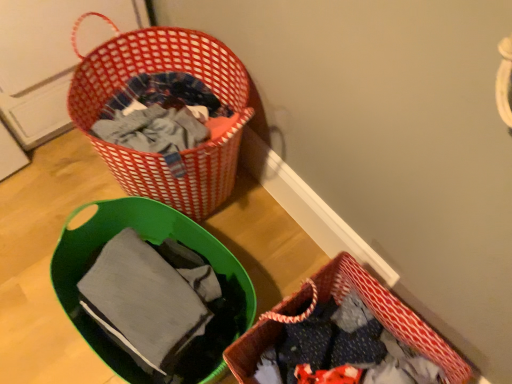
What is the approximate width of red woven basket at upper left, placed as the first picnic basket when sorted from left to right?

red woven basket at upper left, placed as the first picnic basket when sorted from left to right, is 15.67 inches wide.

Describe the element at coordinates (164, 71) in the screenshot. I see `red woven basket at upper left, the first picnic basket when ordered from top to bottom` at that location.

In order to face red woven picnic basket at lower right, arranged as the 2th picnic basket when viewed from the left, should I rotate leftwards or rightwards?

Rotate right and turn 11.274 degrees.

Where is `red woven picnic basket at lower right, arranged as the 2th picnic basket when viewed from the left`? Image resolution: width=512 pixels, height=384 pixels. red woven picnic basket at lower right, arranged as the 2th picnic basket when viewed from the left is located at coordinates (339, 298).

The width and height of the screenshot is (512, 384). Identify the location of red woven basket at upper left, the 2th picnic basket ordered from the bottom. (164, 71).

Considering the sizes of objects red woven picnic basket at lower right, which ranks as the 2th picnic basket in top-to-bottom order, and matte gray fabric at lower left in the image provided, who is thinner, red woven picnic basket at lower right, which ranks as the 2th picnic basket in top-to-bottom order, or matte gray fabric at lower left?

Thinner between the two is matte gray fabric at lower left.

Which object is further away from the camera taking this photo, red woven picnic basket at lower right, arranged as the first picnic basket when viewed from the right, or matte gray fabric at lower left?

matte gray fabric at lower left is more distant.

At what (x,y) coordinates should I click in order to perform the action: click on baby clothe behind the red woven picnic basket at lower right, which is counted as the first picnic basket, starting from the bottom. Please return your answer as a coordinate pair (x, y). This screenshot has height=384, width=512. Looking at the image, I should click on (149, 298).

You are a GUI agent. You are given a task and a screenshot of the screen. Output one action in this format:
    pyautogui.click(x=<x>, y=<y>)
    Task: Click on the picnic basket that is on the right side of red woven basket at upper left, the 2th picnic basket ordered from the bottom
    This screenshot has height=384, width=512.
    Given the screenshot: What is the action you would take?
    pyautogui.click(x=339, y=298)

In the scene shown: Measure the distance between red woven picnic basket at lower right, which is counted as the first picnic basket, starting from the bottom, and red woven basket at upper left, placed as the first picnic basket when sorted from left to right.

They are 22.45 inches apart.

Considering the relative sizes of red woven picnic basket at lower right, arranged as the first picnic basket when viewed from the right, and red woven basket at upper left, the first picnic basket when ordered from top to bottom, in the image provided, is red woven picnic basket at lower right, arranged as the first picnic basket when viewed from the right, thinner than red woven basket at upper left, the first picnic basket when ordered from top to bottom,?

Yes, red woven picnic basket at lower right, arranged as the first picnic basket when viewed from the right, is thinner than red woven basket at upper left, the first picnic basket when ordered from top to bottom.

Is red woven picnic basket at lower right, arranged as the 2th picnic basket when viewed from the left, aimed at red woven basket at upper left, the second picnic basket viewed from the right?

No.

Who is smaller, red woven basket at upper left, placed as the first picnic basket when sorted from left to right, or red woven picnic basket at lower right, which is counted as the first picnic basket, starting from the bottom?

With smaller size is red woven picnic basket at lower right, which is counted as the first picnic basket, starting from the bottom.

Between red woven basket at upper left, placed as the first picnic basket when sorted from left to right, and red woven picnic basket at lower right, which ranks as the 2th picnic basket in top-to-bottom order, which one has more height?

With more height is red woven basket at upper left, placed as the first picnic basket when sorted from left to right.

Looking at this image, is red woven basket at upper left, the 2th picnic basket ordered from the bottom, not within red woven picnic basket at lower right, which is counted as the first picnic basket, starting from the bottom?

Indeed, red woven basket at upper left, the 2th picnic basket ordered from the bottom, is completely outside red woven picnic basket at lower right, which is counted as the first picnic basket, starting from the bottom.

From a real-world perspective, between red woven basket at upper left, the first picnic basket when ordered from top to bottom, and red woven picnic basket at lower right, which ranks as the 2th picnic basket in top-to-bottom order, who is vertically higher?

In real-world perspective, red woven basket at upper left, the first picnic basket when ordered from top to bottom, is above.

Is matte gray fabric at lower left taller than red woven basket at upper left, the 2th picnic basket ordered from the bottom?

No, matte gray fabric at lower left is not taller than red woven basket at upper left, the 2th picnic basket ordered from the bottom.

From a real-world perspective, is matte gray fabric at lower left below red woven basket at upper left, the 2th picnic basket ordered from the bottom?

Actually, matte gray fabric at lower left is physically above red woven basket at upper left, the 2th picnic basket ordered from the bottom, in the real world.

How many degrees apart are the facing directions of matte gray fabric at lower left and red woven basket at upper left, the first picnic basket when ordered from top to bottom?

9.49 degrees separate the facing orientations of matte gray fabric at lower left and red woven basket at upper left, the first picnic basket when ordered from top to bottom.

How much distance is there between matte gray fabric at lower left and red woven basket at upper left, the second picnic basket viewed from the right?

13.85 inches.

From a real-world perspective, who is located higher, matte gray fabric at lower left or red woven picnic basket at lower right, which ranks as the 2th picnic basket in top-to-bottom order?

matte gray fabric at lower left is physically above.

Can you confirm if matte gray fabric at lower left is bigger than red woven picnic basket at lower right, arranged as the first picnic basket when viewed from the right?

Actually, matte gray fabric at lower left might be smaller than red woven picnic basket at lower right, arranged as the first picnic basket when viewed from the right.

Is matte gray fabric at lower left in contact with red woven picnic basket at lower right, which ranks as the 2th picnic basket in top-to-bottom order?

No, matte gray fabric at lower left is not beside red woven picnic basket at lower right, which ranks as the 2th picnic basket in top-to-bottom order.

Is matte gray fabric at lower left turned away from red woven picnic basket at lower right, which is counted as the first picnic basket, starting from the bottom?

matte gray fabric at lower left is not turned away from red woven picnic basket at lower right, which is counted as the first picnic basket, starting from the bottom.

Are red woven basket at upper left, the first picnic basket when ordered from top to bottom, and matte gray fabric at lower left making contact?

No, red woven basket at upper left, the first picnic basket when ordered from top to bottom, is not making contact with matte gray fabric at lower left.

From a real-world perspective, which is physically below, red woven basket at upper left, the second picnic basket viewed from the right, or matte gray fabric at lower left?

red woven basket at upper left, the second picnic basket viewed from the right.

Is red woven basket at upper left, placed as the first picnic basket when sorted from left to right, wider or thinner than matte gray fabric at lower left?

Clearly, red woven basket at upper left, placed as the first picnic basket when sorted from left to right, has more width compared to matte gray fabric at lower left.

Considering the relative sizes of red woven basket at upper left, the second picnic basket viewed from the right, and matte gray fabric at lower left in the image provided, is red woven basket at upper left, the second picnic basket viewed from the right, smaller than matte gray fabric at lower left?

No, red woven basket at upper left, the second picnic basket viewed from the right, is not smaller than matte gray fabric at lower left.

You are a GUI agent. You are given a task and a screenshot of the screen. Output one action in this format:
    pyautogui.click(x=<x>, y=<y>)
    Task: Click on the baby clothe on the left of red woven picnic basket at lower right, which is counted as the first picnic basket, starting from the bottom
    This screenshot has height=384, width=512.
    Given the screenshot: What is the action you would take?
    pyautogui.click(x=149, y=298)

At what (x,y) coordinates should I click in order to perform the action: click on picnic basket lying on the right of red woven basket at upper left, the first picnic basket when ordered from top to bottom. Please return your answer as a coordinate pair (x, y). Looking at the image, I should click on (339, 298).

Estimate the real-world distances between objects in this image. Which object is closer to red woven basket at upper left, the 2th picnic basket ordered from the bottom, matte gray fabric at lower left or red woven picnic basket at lower right, which is counted as the first picnic basket, starting from the bottom?

matte gray fabric at lower left is positioned closer to the anchor red woven basket at upper left, the 2th picnic basket ordered from the bottom.

Estimate the real-world distances between objects in this image. Which object is further from matte gray fabric at lower left, red woven basket at upper left, the second picnic basket viewed from the right, or red woven picnic basket at lower right, arranged as the 2th picnic basket when viewed from the left?

Among the two, red woven basket at upper left, the second picnic basket viewed from the right, is located further to matte gray fabric at lower left.

Considering their positions, is red woven picnic basket at lower right, arranged as the 2th picnic basket when viewed from the left, positioned closer to red woven basket at upper left, the first picnic basket when ordered from top to bottom, than matte gray fabric at lower left?

matte gray fabric at lower left.

Based on their spatial positions, is red woven picnic basket at lower right, arranged as the 2th picnic basket when viewed from the left, or red woven basket at upper left, the first picnic basket when ordered from top to bottom, closer to matte gray fabric at lower left?

red woven picnic basket at lower right, arranged as the 2th picnic basket when viewed from the left, lies closer to matte gray fabric at lower left than the other object.

Which object lies further to the anchor point red woven picnic basket at lower right, arranged as the 2th picnic basket when viewed from the left, matte gray fabric at lower left or red woven basket at upper left, placed as the first picnic basket when sorted from left to right?

The object further to red woven picnic basket at lower right, arranged as the 2th picnic basket when viewed from the left, is red woven basket at upper left, placed as the first picnic basket when sorted from left to right.

From the image, which object appears to be nearer to red woven picnic basket at lower right, arranged as the 2th picnic basket when viewed from the left, red woven basket at upper left, the 2th picnic basket ordered from the bottom, or matte gray fabric at lower left?

Among the two, matte gray fabric at lower left is located nearer to red woven picnic basket at lower right, arranged as the 2th picnic basket when viewed from the left.

Image resolution: width=512 pixels, height=384 pixels. Find the location of `baby clothe that lies between red woven basket at upper left, the first picnic basket when ordered from top to bottom, and red woven picnic basket at lower right, arranged as the first picnic basket when viewed from the right, from top to bottom`. baby clothe that lies between red woven basket at upper left, the first picnic basket when ordered from top to bottom, and red woven picnic basket at lower right, arranged as the first picnic basket when viewed from the right, from top to bottom is located at coordinates (149, 298).